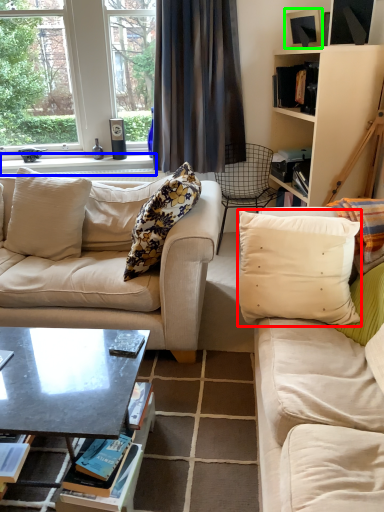
Question: Considering the real-world distances, which object is farthest from pillow (highlighted by a red box)? window sill (highlighted by a blue box) or picture frame (highlighted by a green box)?

Choices:
 (A) window sill
 (B) picture frame

Answer: (A)